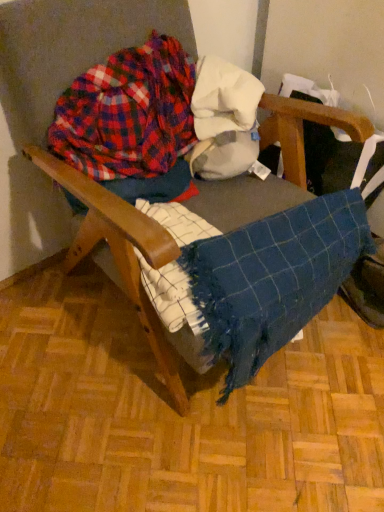
What are the coordinates of `vacant area situated below blue woven blanket at center (from a real-world perspective)` in the screenshot? It's located at (290, 360).